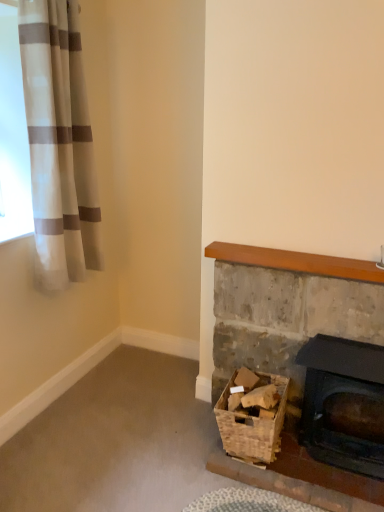
Locate an element on the screen. Image resolution: width=384 pixels, height=512 pixels. free space between woven brown basket at lower right and matte black fireplace at lower right, which ranks as the 2th fireplace in left-to-right order is located at coordinates (311, 475).